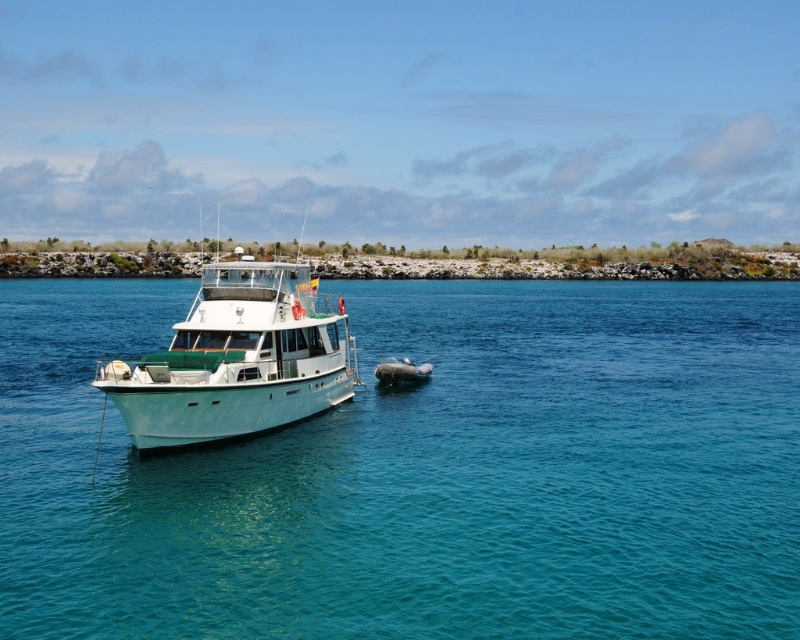
Question: Which point is farther to the camera?

Choices:
 (A) white glossy boat at left
 (B) clear blue water at center

Answer: (A)

Question: Can you confirm if clear blue water at center is smaller than white glossy boat at left?

Choices:
 (A) yes
 (B) no

Answer: (A)

Question: Among these points, which one is nearest to the camera?

Choices:
 (A) (218, 449)
 (B) (160, 426)

Answer: (B)

Question: Is clear blue water at center to the left of white glossy boat at left from the viewer's perspective?

Choices:
 (A) no
 (B) yes

Answer: (A)

Question: Which point is farther to the camera?

Choices:
 (A) (310, 305)
 (B) (417, 616)

Answer: (A)

Question: Is clear blue water at center below white glossy boat at left?

Choices:
 (A) yes
 (B) no

Answer: (A)